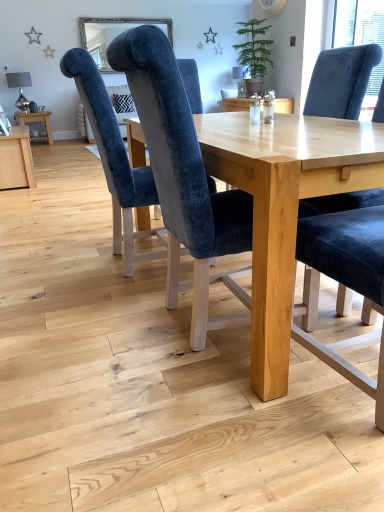
What do you see at coordinates (254, 48) in the screenshot? I see `green matte potted plant at upper center` at bounding box center [254, 48].

What do you see at coordinates (35, 121) in the screenshot? I see `matte wooden table at left, which ranks as the 2th table in front-to-back order` at bounding box center [35, 121].

I want to click on matte wooden table at left, which is the first table from back to front, so click(35, 121).

This screenshot has width=384, height=512. In order to click on light wood table at center, which appears as the 2th table when viewed from the back in this screenshot , I will do `click(284, 206)`.

Does velvet blue chair at center, acting as the third chair starting from the right, have a greater width compared to green matte potted plant at upper center?

Correct, the width of velvet blue chair at center, acting as the third chair starting from the right, exceeds that of green matte potted plant at upper center.

Is velvet blue chair at center, acting as the third chair starting from the right, facing towards green matte potted plant at upper center?

No, velvet blue chair at center, acting as the third chair starting from the right, is not facing towards green matte potted plant at upper center.

From the image's perspective, is velvet blue chair at center, acting as the third chair starting from the right, located beneath green matte potted plant at upper center?

Indeed, from the image's perspective, velvet blue chair at center, acting as the third chair starting from the right, is shown beneath green matte potted plant at upper center.

Is velvet blue chair at center, acting as the 1th chair starting from the left, not close to light wood table at center, which ranks as the 1th table in front-to-back order?

Actually, velvet blue chair at center, acting as the 1th chair starting from the left, and light wood table at center, which ranks as the 1th table in front-to-back order, are a little close together.

Consider the image. Which object is thinner, velvet blue chair at center, acting as the third chair starting from the right, or light wood table at center, arranged as the second table when viewed from the left?

velvet blue chair at center, acting as the third chair starting from the right, is thinner.

Looking at the image, does velvet blue chair at center, acting as the 1th chair starting from the left, seem bigger or smaller compared to light wood table at center, which is the 1th table in bottom-to-top order?

Clearly, velvet blue chair at center, acting as the 1th chair starting from the left, is smaller in size than light wood table at center, which is the 1th table in bottom-to-top order.

From a real-world perspective, is velvet blue chair at center, acting as the 1th chair starting from the left, physically located above or below light wood table at center, which ranks as the 1th table in front-to-back order?

Clearly, from a real-world perspective, velvet blue chair at center, acting as the 1th chair starting from the left, is above light wood table at center, which ranks as the 1th table in front-to-back order.

From a real-world perspective, which is physically above, light wood table at center, which ranks as the 1th table in right-to-left order, or green matte potted plant at upper center?

green matte potted plant at upper center.

From the image's perspective, between light wood table at center, which ranks as the 1th table in front-to-back order, and green matte potted plant at upper center, which one is located above?

green matte potted plant at upper center is shown above in the image.

Considering the sizes of light wood table at center, positioned as the 2th table in top-to-bottom order, and green matte potted plant at upper center in the image, is light wood table at center, positioned as the 2th table in top-to-bottom order, taller or shorter than green matte potted plant at upper center?

Considering their sizes, light wood table at center, positioned as the 2th table in top-to-bottom order, has more height than green matte potted plant at upper center.

Is light wood table at center, which appears as the 2th table when viewed from the back, wider than green matte potted plant at upper center?

Correct, the width of light wood table at center, which appears as the 2th table when viewed from the back, exceeds that of green matte potted plant at upper center.

Is light wood table at center, arranged as the second table when viewed from the left, oriented towards velvet blue chair at center, acting as the third chair starting from the right?

Yes.

Which is in front, light wood table at center, arranged as the second table when viewed from the left, or velvet blue chair at center, acting as the third chair starting from the right?

light wood table at center, arranged as the second table when viewed from the left, is in front.

Who is smaller, light wood table at center, positioned as the 2th table in top-to-bottom order, or velvet blue chair at center, acting as the third chair starting from the right?

With smaller size is velvet blue chair at center, acting as the third chair starting from the right.

In the image, is light wood table at center, which ranks as the 1th table in right-to-left order, on the left side or the right side of velvet blue chair at center, acting as the 1th chair starting from the left?

In the image, light wood table at center, which ranks as the 1th table in right-to-left order, appears on the right side of velvet blue chair at center, acting as the 1th chair starting from the left.

Is green matte potted plant at upper center to the left or to the right of velvet blue chair at center, the 3th chair when ordered from left to right, in the image?

Based on their positions, green matte potted plant at upper center is located to the left of velvet blue chair at center, the 3th chair when ordered from left to right.

Is green matte potted plant at upper center placed right next to velvet blue chair at center, the 3th chair when ordered from left to right?

green matte potted plant at upper center and velvet blue chair at center, the 3th chair when ordered from left to right, are not in contact.

From their relative heights in the image, would you say green matte potted plant at upper center is taller or shorter than velvet blue chair at center, which is counted as the 1th chair, starting from the right?

green matte potted plant at upper center is shorter than velvet blue chair at center, which is counted as the 1th chair, starting from the right.

Can you confirm if green matte potted plant at upper center is thinner than velvet blue chair at center, the 3th chair when ordered from left to right?

Yes.

Measure the distance between matte wooden table at left, which is the 1th table in left-to-right order, and velvet blue chair at center, which is counted as the 1th chair, starting from the right.

matte wooden table at left, which is the 1th table in left-to-right order, is 5.04 meters away from velvet blue chair at center, which is counted as the 1th chair, starting from the right.

From the image's perspective, which object appears higher, matte wooden table at left, the second table when ordered from bottom to top, or velvet blue chair at center, which is counted as the 1th chair, starting from the right?

From the image's view, matte wooden table at left, the second table when ordered from bottom to top, is above.

Is matte wooden table at left, which is the first table from back to front, not near velvet blue chair at center, which is counted as the 1th chair, starting from the right?

Yes, matte wooden table at left, which is the first table from back to front, is far from velvet blue chair at center, which is counted as the 1th chair, starting from the right.

In the image, is matte wooden table at left, the second table when ordered from bottom to top, positioned in front of or behind velvet blue chair at center, which is counted as the 1th chair, starting from the right?

matte wooden table at left, the second table when ordered from bottom to top, is positioned farther from the viewer than velvet blue chair at center, which is counted as the 1th chair, starting from the right.

Does velvet blue chair at center, which is counted as the 1th chair, starting from the right, have a larger size compared to matte wooden table at left, the 1th table positioned from the top?

Indeed, velvet blue chair at center, which is counted as the 1th chair, starting from the right, has a larger size compared to matte wooden table at left, the 1th table positioned from the top.

Looking at this image, from the image's perspective, is velvet blue chair at center, which is counted as the 1th chair, starting from the right, above or below matte wooden table at left, which is the first table from back to front?

Based on their image positions, velvet blue chair at center, which is counted as the 1th chair, starting from the right, is located beneath matte wooden table at left, which is the first table from back to front.

Considering the sizes of objects velvet blue chair at center, the 3th chair when ordered from left to right, and matte wooden table at left, the 1th table positioned from the top, in the image provided, who is thinner, velvet blue chair at center, the 3th chair when ordered from left to right, or matte wooden table at left, the 1th table positioned from the top,?

velvet blue chair at center, the 3th chair when ordered from left to right, is thinner.

Between velvet blue chair at center, which is counted as the 1th chair, starting from the right, and matte wooden table at left, the 1th table positioned from the top, which one appears on the left side from the viewer's perspective?

From the viewer's perspective, matte wooden table at left, the 1th table positioned from the top, appears more on the left side.

At what (x,y) coordinates should I click in order to perform the action: click on plant that is on the right side of velvet blue chair at center, acting as the third chair starting from the right. Please return your answer as a coordinate pair (x, y). Looking at the image, I should click on (254, 48).

Locate an element on the screen. The height and width of the screenshot is (512, 384). table in front of the velvet blue chair at center, acting as the 1th chair starting from the left is located at coordinates (284, 206).

Which object lies further to the anchor point velvet blue chair at center, acting as the 1th chair starting from the left, light wood table at center, which appears as the 2th table when viewed from the back, or velvet blue chair at center, positioned as the 2th chair in right-to-left order?

light wood table at center, which appears as the 2th table when viewed from the back.

Which object lies further to the anchor point velvet blue chair at center, acting as the 1th chair starting from the left, green matte potted plant at upper center or velvet blue chair at center, the 3th chair when ordered from left to right?

green matte potted plant at upper center lies further to velvet blue chair at center, acting as the 1th chair starting from the left, than the other object.

Estimate the real-world distances between objects in this image. Which object is closer to velvet blue chair at center, which is counted as the 1th chair, starting from the right, matte wooden table at left, the second table when ordered from bottom to top, or light wood table at center, which appears as the 2th table when viewed from the back?

The object closer to velvet blue chair at center, which is counted as the 1th chair, starting from the right, is light wood table at center, which appears as the 2th table when viewed from the back.

When comparing their distances from green matte potted plant at upper center, does velvet blue chair at center, acting as the third chair starting from the right, or matte wooden table at left, which is the 1th table in left-to-right order, seem closer?

velvet blue chair at center, acting as the third chair starting from the right, lies closer to green matte potted plant at upper center than the other object.

From the image, which object appears to be nearer to light wood table at center, which ranks as the 1th table in front-to-back order, matte wooden table at left, which is the 1th table in left-to-right order, or green matte potted plant at upper center?

The object closer to light wood table at center, which ranks as the 1th table in front-to-back order, is green matte potted plant at upper center.

When comparing their distances from light wood table at center, arranged as the second table when viewed from the left, does green matte potted plant at upper center or matte wooden table at left, which is the 1th table in left-to-right order, seem further?

matte wooden table at left, which is the 1th table in left-to-right order, is further to light wood table at center, arranged as the second table when viewed from the left.

Which object lies further to the anchor point velvet blue chair at center, acting as the third chair starting from the right, green matte potted plant at upper center or light wood table at center, positioned as the 2th table in top-to-bottom order?

The object further to velvet blue chair at center, acting as the third chair starting from the right, is green matte potted plant at upper center.

Based on their spatial positions, is matte wooden table at left, which ranks as the 2th table in front-to-back order, or velvet blue chair at center, arranged as the second chair when viewed from the left, closer to green matte potted plant at upper center?

matte wooden table at left, which ranks as the 2th table in front-to-back order, lies closer to green matte potted plant at upper center than the other object.

Image resolution: width=384 pixels, height=512 pixels. In order to click on table between velvet blue chair at center, which is counted as the 1th chair, starting from the right, and matte wooden table at left, the second table when ordered from bottom to top, along the z-axis in this screenshot , I will do `click(284, 206)`.

You are a GUI agent. You are given a task and a screenshot of the screen. Output one action in this format:
    pyautogui.click(x=<x>, y=<y>)
    Task: Click on the plant between velvet blue chair at center, which is counted as the 1th chair, starting from the right, and matte wooden table at left, which is the first table from back to front, along the z-axis
    This screenshot has width=384, height=512.
    Given the screenshot: What is the action you would take?
    pyautogui.click(x=254, y=48)

The height and width of the screenshot is (512, 384). In order to click on table between velvet blue chair at center, arranged as the second chair when viewed from the left, and velvet blue chair at center, the 3th chair when ordered from left to right, in the horizontal direction in this screenshot , I will do `click(284, 206)`.

Find the location of a particular element. plant between light wood table at center, which ranks as the 1th table in right-to-left order, and matte wooden table at left, which ranks as the 2th table in right-to-left order, in the front-back direction is located at coordinates (254, 48).